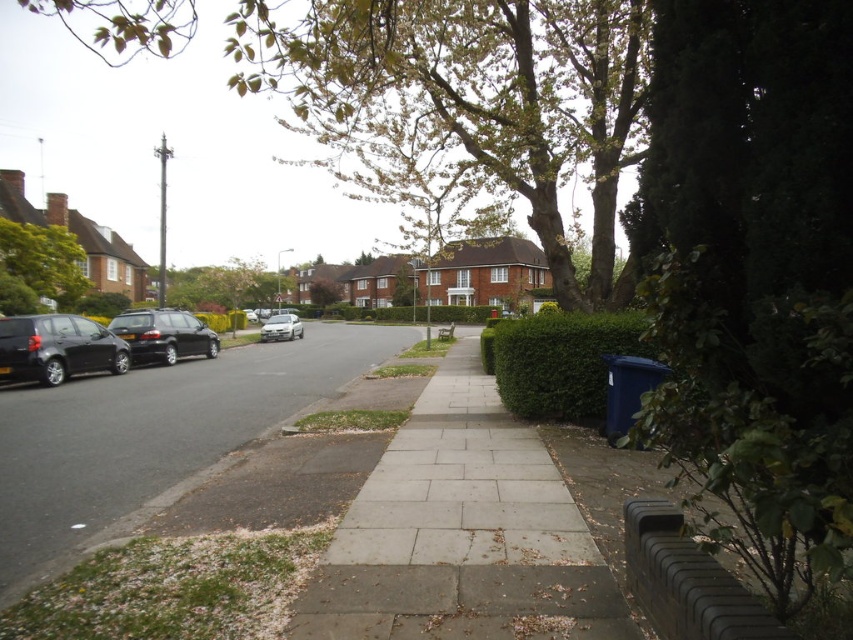
Does gray concrete sidewalk at center have a lesser height compared to gray concrete sidewalk at lower left?

Yes.

Is gray concrete sidewalk at center below gray concrete sidewalk at lower left?

Correct, gray concrete sidewalk at center is located below gray concrete sidewalk at lower left.

The image size is (853, 640). I want to click on gray concrete sidewalk at center, so click(x=462, y=532).

At what (x,y) coordinates should I click in order to perform the action: click on gray concrete sidewalk at center. Please return your answer as a coordinate pair (x, y). This screenshot has width=853, height=640. Looking at the image, I should click on (462, 532).

How much distance is there between black rubber curb at lower right and green leafy tree at upper left?

The distance of black rubber curb at lower right from green leafy tree at upper left is 29.96 meters.

Between point (717, 604) and point (49, 241), which one is positioned behind?

Point (49, 241)

Does point (672, 616) come behind point (71, 259)?

No, (672, 616) is closer to viewer.

The height and width of the screenshot is (640, 853). I want to click on black rubber curb at lower right, so point(686,580).

Which of these two, matte black car at left or brown textured tree at center, stands taller?

brown textured tree at center

Is point (117, 364) positioned before point (326, 298)?

Yes, it is in front of point (326, 298).

This screenshot has height=640, width=853. I want to click on matte black car at left, so click(57, 348).